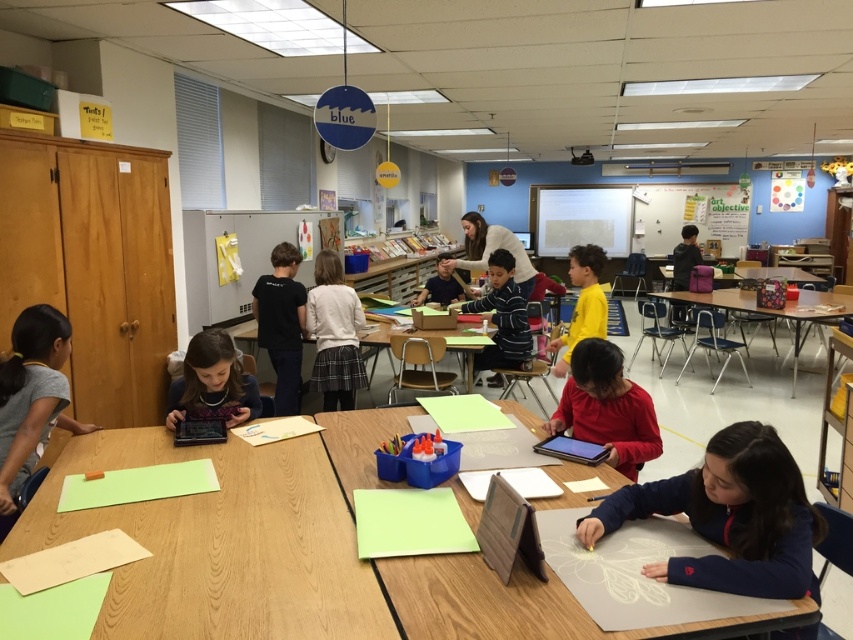
You are a teacher standing at the front of the classroom. You need to hand out new art supplies to the students. The supplies are placed on the wooden table at center and the gray fabric shirt at left. Which object should you move first to access the supplies?

The wooden table at center is located below the gray fabric shirt at left, so you should move the gray fabric shirt at left first to access the supplies on the wooden table at center.